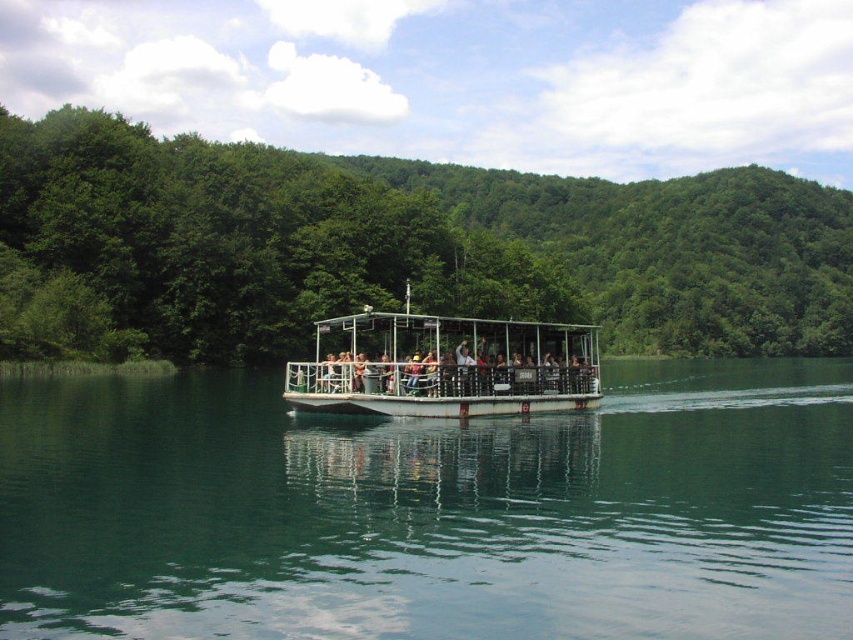
Between point (837, 627) and point (589, 394), which one is positioned behind?

The point (589, 394) is behind.

Measure the distance between green glassy water at center and camera.

The distance of green glassy water at center from camera is 9.91 meters.

Who is more distant from viewer, (x=421, y=472) or (x=527, y=380)?

Point (x=527, y=380)

Locate an element on the screen. The width and height of the screenshot is (853, 640). green glassy water at center is located at coordinates (431, 512).

Which is behind, point (646, 582) or point (451, 380)?

Positioned behind is point (451, 380).

Can you confirm if green glassy water at center is wider than matte black boat at center?

Yes, green glassy water at center is wider than matte black boat at center.

Who is more forward, (67, 637) or (474, 376)?

Point (67, 637) is more forward.

Where is `green glassy water at center`? The image size is (853, 640). green glassy water at center is located at coordinates (431, 512).

Between green leafy trees at center and white metal boat at center, which one has less height?

With less height is white metal boat at center.

Between green leafy trees at center and white metal boat at center, which one appears on the left side from the viewer's perspective?

white metal boat at center is more to the left.

Does point (718, 220) come in front of point (520, 340)?

No, (718, 220) is behind (520, 340).

At what (x,y) coordinates should I click in order to perform the action: click on green leafy trees at center. Please return your answer as a coordinate pair (x, y). Looking at the image, I should click on (393, 248).